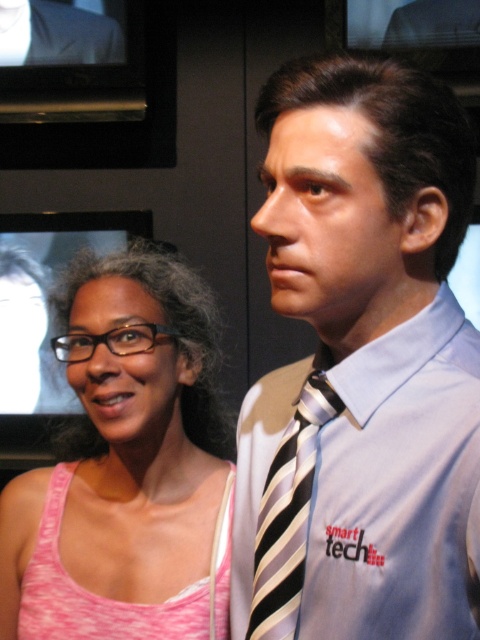
Who is shorter, pink fabric tank top at left or matte black suit at center?

With less height is matte black suit at center.

Is the position of pink fabric tank top at left less distant than that of matte black suit at center?

Yes, it is in front of matte black suit at center.

Between point (139, 593) and point (468, 22), which one is positioned in front?

Point (139, 593) is in front.

Locate an element on the screen. The image size is (480, 640). pink fabric tank top at left is located at coordinates (127, 467).

Image resolution: width=480 pixels, height=640 pixels. Describe the element at coordinates (127, 467) in the screenshot. I see `pink fabric tank top at left` at that location.

Consider the image. Can you confirm if pink fabric tank top at left is positioned above striped silk tie at center?

Correct, pink fabric tank top at left is located above striped silk tie at center.

I want to click on pink fabric tank top at left, so click(127, 467).

Identify the location of pink fabric tank top at left. (127, 467).

Can you confirm if pink fabric tank top at left is smaller than matte black suit at upper left?

Actually, pink fabric tank top at left might be larger than matte black suit at upper left.

Is pink fabric tank top at left positioned before matte black suit at upper left?

Yes, it is.

Is point (142, 260) in front of point (29, 17)?

Yes, it is in front of point (29, 17).

Where is `pink fabric tank top at left`? pink fabric tank top at left is located at coordinates (x=127, y=467).